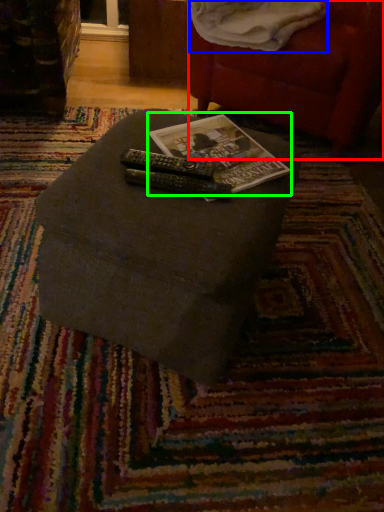
Question: Considering the real-world distances, which object is closest to bean bag chair (highlighted by a red box)? blanket (highlighted by a blue box) or paperback book (highlighted by a green box).

Choices:
 (A) blanket
 (B) paperback book

Answer: (A)